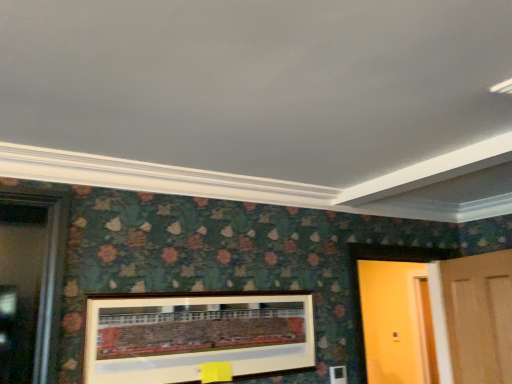
Question: Can you confirm if wooden door at right, the second door positioned from the left, is bigger than wooden picture frame at center?

Choices:
 (A) yes
 (B) no

Answer: (A)

Question: Is the position of wooden door at right, the second door positioned from the left, less distant than that of wooden picture frame at center?

Choices:
 (A) no
 (B) yes

Answer: (A)

Question: From the image's perspective, would you say wooden door at right, which is the first door in right-to-left order, is positioned over wooden picture frame at center?

Choices:
 (A) no
 (B) yes

Answer: (A)

Question: From a real-world perspective, is wooden door at right, which is the first door in right-to-left order, positioned over wooden picture frame at center based on gravity?

Choices:
 (A) yes
 (B) no

Answer: (A)

Question: From the image's perspective, does wooden door at right, the second door positioned from the left, appear lower than wooden picture frame at center?

Choices:
 (A) yes
 (B) no

Answer: (A)

Question: Does wooden door at right, the second door positioned from the left, have a lesser width compared to wooden picture frame at center?

Choices:
 (A) no
 (B) yes

Answer: (A)

Question: From a real-world perspective, does wooden picture frame at center sit lower than wooden door at right, which is the first door in left-to-right order?

Choices:
 (A) no
 (B) yes

Answer: (B)

Question: Does wooden picture frame at center have a greater width compared to wooden door at right, the 2th door in the right-to-left sequence?

Choices:
 (A) yes
 (B) no

Answer: (B)

Question: Is wooden picture frame at center not within wooden door at right, the 2th door in the right-to-left sequence?

Choices:
 (A) no
 (B) yes

Answer: (B)

Question: From a real-world perspective, is wooden picture frame at center over wooden door at right, the 2th door in the right-to-left sequence?

Choices:
 (A) no
 (B) yes

Answer: (A)

Question: Does wooden picture frame at center have a smaller size compared to wooden door at right, which is the first door in left-to-right order?

Choices:
 (A) yes
 (B) no

Answer: (A)

Question: Is wooden picture frame at center thinner than wooden door at right, which is the first door in left-to-right order?

Choices:
 (A) yes
 (B) no

Answer: (A)

Question: Is wooden door at right, which is the first door in left-to-right order, at the right side of wooden door at right, the second door positioned from the left?

Choices:
 (A) yes
 (B) no

Answer: (B)